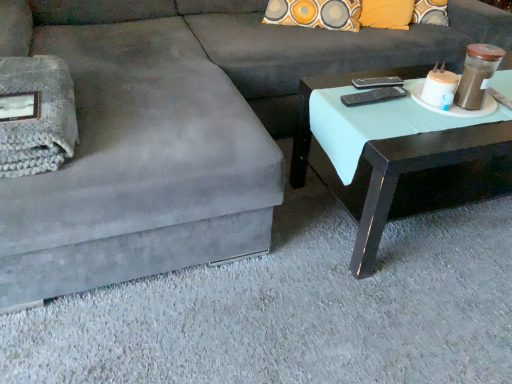
I want to click on free space above matte black coffee table at right (from a real-world perspective), so click(425, 103).